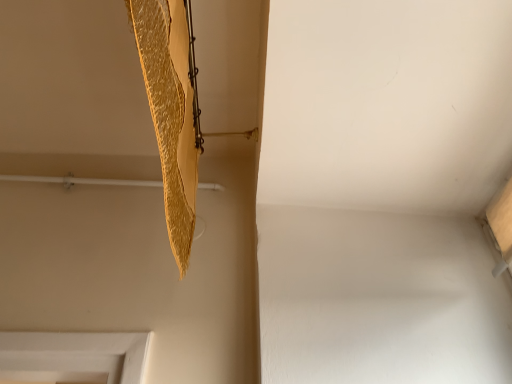
Identify the location of white glossy pipe at upper left. The image size is (512, 384). 81,181.

This screenshot has width=512, height=384. What do you see at coordinates (81, 181) in the screenshot? I see `white glossy pipe at upper left` at bounding box center [81, 181].

Where is `white glossy pipe at upper left`? The image size is (512, 384). white glossy pipe at upper left is located at coordinates (81, 181).